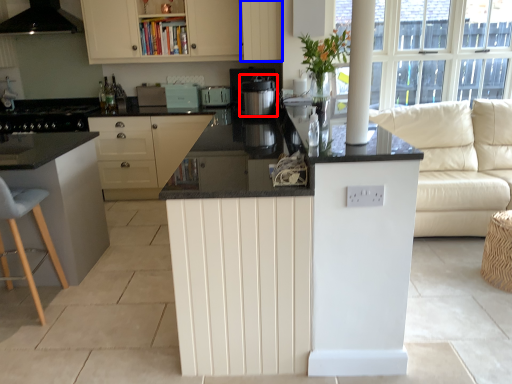
Question: Which point is further to the camera, kitchen appliance (highlighted by a red box) or cabinetry (highlighted by a blue box)?

Choices:
 (A) kitchen appliance
 (B) cabinetry

Answer: (B)